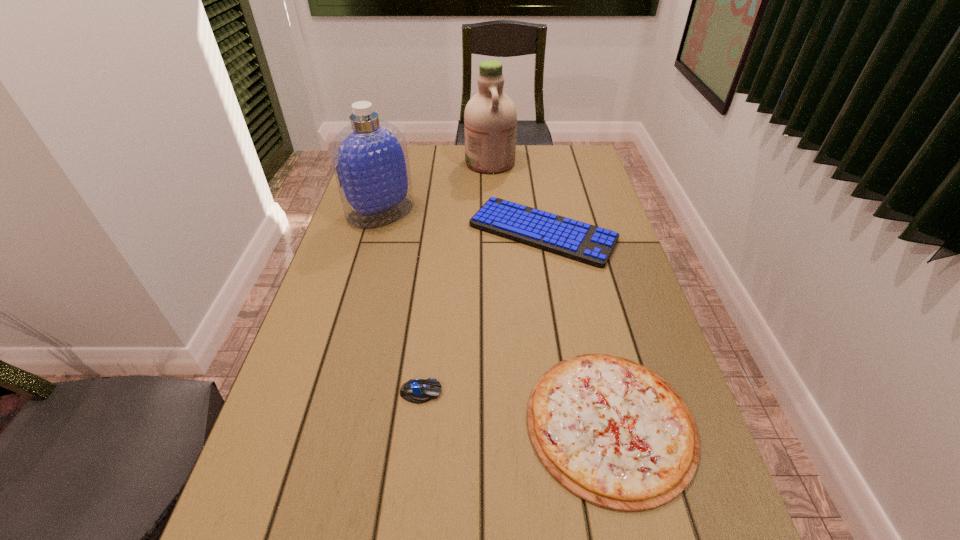
The width and height of the screenshot is (960, 540). I want to click on free region at the right edge of the desktop, so click(x=565, y=198).

The height and width of the screenshot is (540, 960). In the image, there is a desktop. In order to click on vacant space at the far right corner in this screenshot , I will do `click(563, 169)`.

Identify the location of free spot between the right cleansing agent and the fourth object from right to left. This screenshot has height=540, width=960. (456, 277).

Image resolution: width=960 pixels, height=540 pixels. Identify the location of vacant area between the shortest object and the farther cleansing agent. (550, 293).

Where is `free point between the farther cleansing agent and the pizza`? This screenshot has width=960, height=540. free point between the farther cleansing agent and the pizza is located at coordinates (550, 293).

Locate an element on the screen. free point between the fourth object from right to left and the leftmost object is located at coordinates (401, 302).

Image resolution: width=960 pixels, height=540 pixels. Find the location of `free space between the pizza and the second object from left to right`. free space between the pizza and the second object from left to right is located at coordinates (516, 407).

You are a GUI agent. You are given a task and a screenshot of the screen. Output one action in this format:
    pyautogui.click(x=<x>, y=<y>)
    Task: Click on the empty space that is in between the right cleansing agent and the pizza
    
    Given the screenshot: What is the action you would take?
    pyautogui.click(x=550, y=293)

Where is `vacant region between the computer keyboard and the second object from left to right`? The height and width of the screenshot is (540, 960). vacant region between the computer keyboard and the second object from left to right is located at coordinates (482, 312).

I want to click on free space that is in between the shortest object and the farthest object, so click(550, 293).